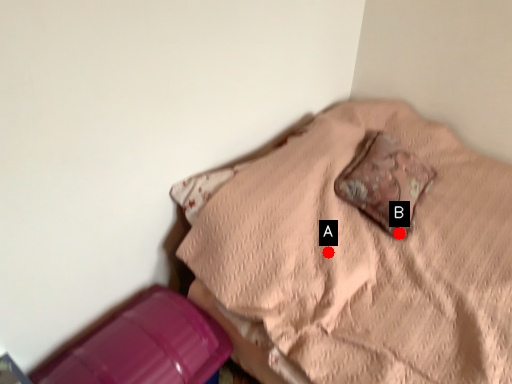
Question: Two points are circled on the image, labeled by A and B beside each circle. Which point is closer to the camera taking this photo?

Choices:
 (A) A is closer
 (B) B is closer

Answer: (A)